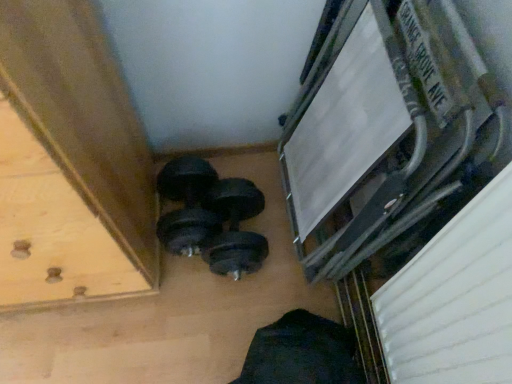
Question: Would you say black rubber dumbbell at center, the 1th dumbbell viewed from the right, is inside or outside wooden drawer at lower left?

Choices:
 (A) outside
 (B) inside

Answer: (A)

Question: From the image's perspective, is black rubber dumbbell at center, which is the 2th dumbbell in left-to-right order, positioned above or below wooden drawer at lower left?

Choices:
 (A) above
 (B) below

Answer: (B)

Question: Estimate the real-world distances between objects in this image. Which object is farther from the wooden drawer at lower left?

Choices:
 (A) metallic silver frame at upper right
 (B) black rubber dumbbell at lower center, the 2th dumbbell from the right
 (C) black rubber dumbbell at center, which is the 2th dumbbell in left-to-right order

Answer: (A)

Question: Which object is the farthest from the metallic silver frame at upper right?

Choices:
 (A) black rubber dumbbell at lower center, the 2th dumbbell from the right
 (B) wooden drawer at lower left
 (C) black rubber dumbbell at center, the 1th dumbbell viewed from the right

Answer: (B)